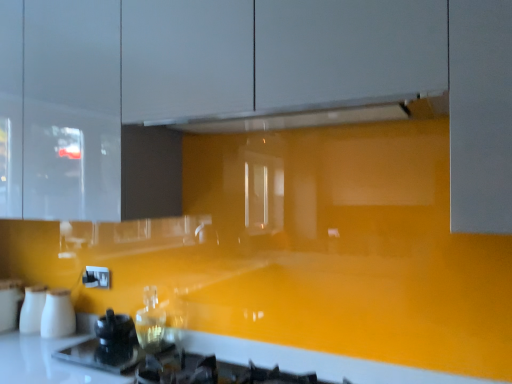
The height and width of the screenshot is (384, 512). Describe the element at coordinates (115, 339) in the screenshot. I see `black glossy kettle at lower left, positioned as the fourth appliance in left-to-right order` at that location.

In order to click on glossy yellow countertop at lower center in this screenshot , I will do `click(316, 362)`.

Identify the location of white glossy exhaust hood at upper center. (319, 115).

From the image's perspective, is white matte milk jugs at lower left, placed as the third appliance when sorted from left to right, located above black glossy kettle at lower left, positioned as the fourth appliance in left-to-right order?

Yes.

Is point (60, 312) farther from camera compared to point (127, 336)?

Yes, it is behind point (127, 336).

Is white matte milk jugs at lower left, placed as the second appliance when sorted from right to left, surrounding black glossy kettle at lower left, which is the first appliance in right-to-left order?

That's incorrect, black glossy kettle at lower left, which is the first appliance in right-to-left order, is not inside white matte milk jugs at lower left, placed as the second appliance when sorted from right to left.

Looking at this image, which is in front, black glossy kettle at lower left, positioned as the fourth appliance in left-to-right order, or glossy yellow countertop at lower center?

glossy yellow countertop at lower center is more forward.

Could you tell me if black glossy kettle at lower left, positioned as the fourth appliance in left-to-right order, is facing glossy yellow countertop at lower center?

No, black glossy kettle at lower left, positioned as the fourth appliance in left-to-right order, is not facing towards glossy yellow countertop at lower center.

Who is shorter, black glossy kettle at lower left, which is the first appliance in right-to-left order, or glossy yellow countertop at lower center?

With less height is glossy yellow countertop at lower center.

From a real-world perspective, is white glossy salt and pepper shakers at left, the 4th appliance viewed from the right, physically located above or below white glossy salt and pepper shakers at lower left, which appears as the 2th appliance when viewed from the left?

Clearly, from a real-world perspective, white glossy salt and pepper shakers at left, the 4th appliance viewed from the right, is below white glossy salt and pepper shakers at lower left, which appears as the 2th appliance when viewed from the left.

Is white glossy salt and pepper shakers at left, the 4th appliance viewed from the right, facing towards white glossy salt and pepper shakers at lower left, which appears as the 2th appliance when viewed from the left?

No, white glossy salt and pepper shakers at left, the 4th appliance viewed from the right, does not turn towards white glossy salt and pepper shakers at lower left, which appears as the 2th appliance when viewed from the left.

Who is shorter, white glossy exhaust hood at upper center or black glossy kettle at lower left, positioned as the fourth appliance in left-to-right order?

Standing shorter between the two is white glossy exhaust hood at upper center.

Who is bigger, white glossy exhaust hood at upper center or black glossy kettle at lower left, which is the first appliance in right-to-left order?

Bigger between the two is white glossy exhaust hood at upper center.

Measure the distance from white glossy exhaust hood at upper center to black glossy kettle at lower left, which is the first appliance in right-to-left order.

white glossy exhaust hood at upper center is 38.85 inches from black glossy kettle at lower left, which is the first appliance in right-to-left order.

In the image, is white glossy exhaust hood at upper center positioned in front of or behind black glossy kettle at lower left, positioned as the fourth appliance in left-to-right order?

white glossy exhaust hood at upper center is in front of black glossy kettle at lower left, positioned as the fourth appliance in left-to-right order.

Is white glossy exhaust hood at upper center directly adjacent to white matte milk jugs at lower left, placed as the second appliance when sorted from right to left?

No, white glossy exhaust hood at upper center is not with white matte milk jugs at lower left, placed as the second appliance when sorted from right to left.

Is white glossy exhaust hood at upper center shorter than white matte milk jugs at lower left, placed as the second appliance when sorted from right to left?

Indeed, white glossy exhaust hood at upper center has a lesser height compared to white matte milk jugs at lower left, placed as the second appliance when sorted from right to left.

From a real-world perspective, is white matte milk jugs at lower left, placed as the second appliance when sorted from right to left, positioned above or below white glossy salt and pepper shakers at lower left, the third appliance viewed from the right?

white matte milk jugs at lower left, placed as the second appliance when sorted from right to left, is situated higher than white glossy salt and pepper shakers at lower left, the third appliance viewed from the right, in the real world.

Considering the sizes of objects white matte milk jugs at lower left, placed as the third appliance when sorted from left to right, and white glossy salt and pepper shakers at lower left, which appears as the 2th appliance when viewed from the left, in the image provided, who is wider, white matte milk jugs at lower left, placed as the third appliance when sorted from left to right, or white glossy salt and pepper shakers at lower left, which appears as the 2th appliance when viewed from the left,?

With larger width is white glossy salt and pepper shakers at lower left, which appears as the 2th appliance when viewed from the left.

Can you confirm if white matte milk jugs at lower left, placed as the third appliance when sorted from left to right, is smaller than white glossy salt and pepper shakers at lower left, the third appliance viewed from the right?

Indeed, white matte milk jugs at lower left, placed as the third appliance when sorted from left to right, has a smaller size compared to white glossy salt and pepper shakers at lower left, the third appliance viewed from the right.

Is white glossy salt and pepper shakers at lower left, which appears as the 2th appliance when viewed from the left, located within white matte milk jugs at lower left, placed as the second appliance when sorted from right to left?

No, white glossy salt and pepper shakers at lower left, which appears as the 2th appliance when viewed from the left, is not surrounded by white matte milk jugs at lower left, placed as the second appliance when sorted from right to left.

Is white glossy salt and pepper shakers at left, which appears as the 1th appliance when viewed from the left, placed right next to glossy yellow countertop at lower center?

No, white glossy salt and pepper shakers at left, which appears as the 1th appliance when viewed from the left, is not beside glossy yellow countertop at lower center.

Does white glossy salt and pepper shakers at left, which appears as the 1th appliance when viewed from the left, come behind glossy yellow countertop at lower center?

Yes, white glossy salt and pepper shakers at left, which appears as the 1th appliance when viewed from the left, is further from the viewer.

Is white glossy salt and pepper shakers at left, which appears as the 1th appliance when viewed from the left, wider than glossy yellow countertop at lower center?

Indeed, white glossy salt and pepper shakers at left, which appears as the 1th appliance when viewed from the left, has a greater width compared to glossy yellow countertop at lower center.

Between white glossy salt and pepper shakers at left, the 4th appliance viewed from the right, and glossy yellow countertop at lower center, which one has more height?

Standing taller between the two is white glossy salt and pepper shakers at left, the 4th appliance viewed from the right.

Image resolution: width=512 pixels, height=384 pixels. In order to click on the 1st appliance behind the black glossy kettle at lower left, positioned as the fourth appliance in left-to-right order, starting your count from the anchor in this screenshot , I will do `click(58, 315)`.

Identify the location of counter top in front of the black glossy kettle at lower left, positioned as the fourth appliance in left-to-right order. (316, 362).

Looking at this image, looking at the image, which one is located closer to black glossy kettle at lower left, positioned as the fourth appliance in left-to-right order, white glossy salt and pepper shakers at lower left, the third appliance viewed from the right, or white glossy exhaust hood at upper center?

The object closer to black glossy kettle at lower left, positioned as the fourth appliance in left-to-right order, is white glossy salt and pepper shakers at lower left, the third appliance viewed from the right.

When comparing their distances from white matte milk jugs at lower left, placed as the second appliance when sorted from right to left, does white glossy exhaust hood at upper center or black glossy kettle at lower left, positioned as the fourth appliance in left-to-right order, seem further?

white glossy exhaust hood at upper center is positioned further to the anchor white matte milk jugs at lower left, placed as the second appliance when sorted from right to left.

Estimate the real-world distances between objects in this image. Which object is further from white matte milk jugs at lower left, placed as the second appliance when sorted from right to left, white glossy salt and pepper shakers at left, the 4th appliance viewed from the right, or black glossy kettle at lower left, which is the first appliance in right-to-left order?

black glossy kettle at lower left, which is the first appliance in right-to-left order, is positioned further to the anchor white matte milk jugs at lower left, placed as the second appliance when sorted from right to left.

In the scene shown: Based on their spatial positions, is white glossy salt and pepper shakers at left, which appears as the 1th appliance when viewed from the left, or glossy yellow countertop at lower center closer to white glossy exhaust hood at upper center?

glossy yellow countertop at lower center is positioned closer to the anchor white glossy exhaust hood at upper center.

Considering their positions, is glossy yellow countertop at lower center positioned closer to white matte milk jugs at lower left, placed as the third appliance when sorted from left to right, than black glossy kettle at lower left, which is the first appliance in right-to-left order?

black glossy kettle at lower left, which is the first appliance in right-to-left order.

Considering their positions, is glossy yellow countertop at lower center positioned closer to black glossy kettle at lower left, positioned as the fourth appliance in left-to-right order, than white glossy salt and pepper shakers at left, which appears as the 1th appliance when viewed from the left?

The object closer to black glossy kettle at lower left, positioned as the fourth appliance in left-to-right order, is glossy yellow countertop at lower center.

From the image, which object appears to be nearer to white matte milk jugs at lower left, placed as the second appliance when sorted from right to left, black glossy kettle at lower left, which is the first appliance in right-to-left order, or white glossy exhaust hood at upper center?

black glossy kettle at lower left, which is the first appliance in right-to-left order, lies closer to white matte milk jugs at lower left, placed as the second appliance when sorted from right to left, than the other object.

Which object lies nearer to the anchor point glossy yellow countertop at lower center, white glossy salt and pepper shakers at lower left, which appears as the 2th appliance when viewed from the left, or white matte milk jugs at lower left, placed as the third appliance when sorted from left to right?

Based on the image, white matte milk jugs at lower left, placed as the third appliance when sorted from left to right, appears to be nearer to glossy yellow countertop at lower center.

At what (x,y) coordinates should I click in order to perform the action: click on counter top between white glossy salt and pepper shakers at left, which appears as the 1th appliance when viewed from the left, and white glossy exhaust hood at upper center, in the horizontal direction. Please return your answer as a coordinate pair (x, y). Looking at the image, I should click on (316, 362).

You are a GUI agent. You are given a task and a screenshot of the screen. Output one action in this format:
    pyautogui.click(x=<x>, y=<y>)
    Task: Click on the appliance between white glossy salt and pepper shakers at lower left, the third appliance viewed from the right, and black glossy kettle at lower left, which is the first appliance in right-to-left order, from left to right
    
    Given the screenshot: What is the action you would take?
    pyautogui.click(x=58, y=315)

Where is `appliance between white glossy salt and pepper shakers at left, which appears as the 1th appliance when viewed from the left, and white matte milk jugs at lower left, placed as the second appliance when sorted from right to left, from left to right`? Image resolution: width=512 pixels, height=384 pixels. appliance between white glossy salt and pepper shakers at left, which appears as the 1th appliance when viewed from the left, and white matte milk jugs at lower left, placed as the second appliance when sorted from right to left, from left to right is located at coordinates (32, 309).

Where is `counter top between white glossy salt and pepper shakers at lower left, which appears as the 2th appliance when viewed from the left, and white glossy exhaust hood at upper center`? The width and height of the screenshot is (512, 384). counter top between white glossy salt and pepper shakers at lower left, which appears as the 2th appliance when viewed from the left, and white glossy exhaust hood at upper center is located at coordinates (316, 362).